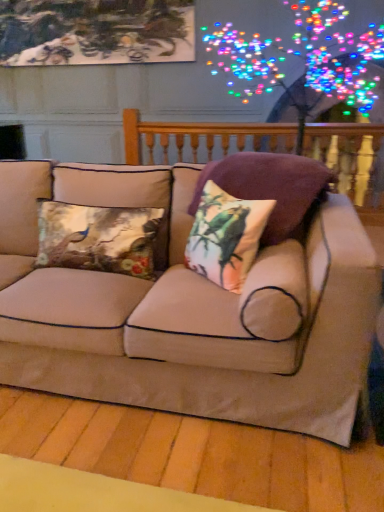
Question: From a real-world perspective, is wooden balustrade at upper center under beige fabric couch at center?

Choices:
 (A) yes
 (B) no

Answer: (B)

Question: Does wooden balustrade at upper center have a smaller size compared to beige fabric couch at center?

Choices:
 (A) yes
 (B) no

Answer: (A)

Question: Is beige fabric couch at center a part of wooden balustrade at upper center?

Choices:
 (A) yes
 (B) no

Answer: (B)

Question: Is wooden balustrade at upper center turned away from beige fabric couch at center?

Choices:
 (A) yes
 (B) no

Answer: (B)

Question: From the image's perspective, is wooden balustrade at upper center located beneath beige fabric couch at center?

Choices:
 (A) no
 (B) yes

Answer: (A)

Question: Can you confirm if wooden balustrade at upper center is positioned to the left of beige fabric couch at center?

Choices:
 (A) yes
 (B) no

Answer: (B)

Question: Does printed fabric cushion at center, which is the second pillow in right-to-left order, have a smaller size compared to wooden balustrade at upper center?

Choices:
 (A) no
 (B) yes

Answer: (B)

Question: From the image's perspective, does printed fabric cushion at center, acting as the second pillow starting from the left, appear higher than wooden balustrade at upper center?

Choices:
 (A) no
 (B) yes

Answer: (A)

Question: Can you confirm if printed fabric cushion at center, acting as the second pillow starting from the left, is thinner than wooden balustrade at upper center?

Choices:
 (A) no
 (B) yes

Answer: (A)

Question: Is printed fabric cushion at center, which is the second pillow in right-to-left order, turned away from wooden balustrade at upper center?

Choices:
 (A) no
 (B) yes

Answer: (A)

Question: Is printed fabric cushion at center, which is the second pillow in right-to-left order, bigger than wooden balustrade at upper center?

Choices:
 (A) yes
 (B) no

Answer: (B)

Question: Can you confirm if printed fabric cushion at center, acting as the second pillow starting from the left, is taller than wooden balustrade at upper center?

Choices:
 (A) yes
 (B) no

Answer: (B)

Question: Is velvet floral pillow at center, the 1th pillow when ordered from right to left, to the right of printed fabric cushion at center, which is the second pillow in right-to-left order, from the viewer's perspective?

Choices:
 (A) yes
 (B) no

Answer: (A)